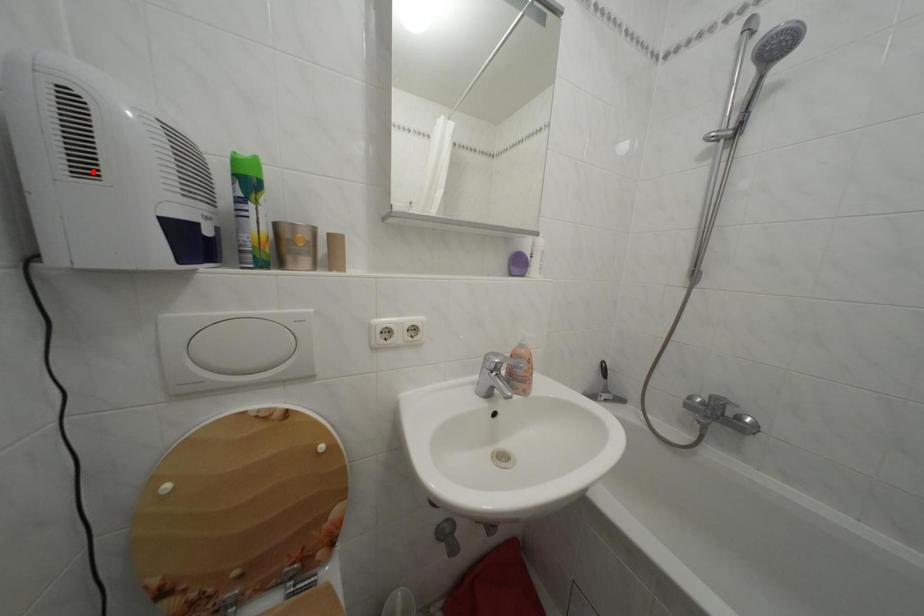
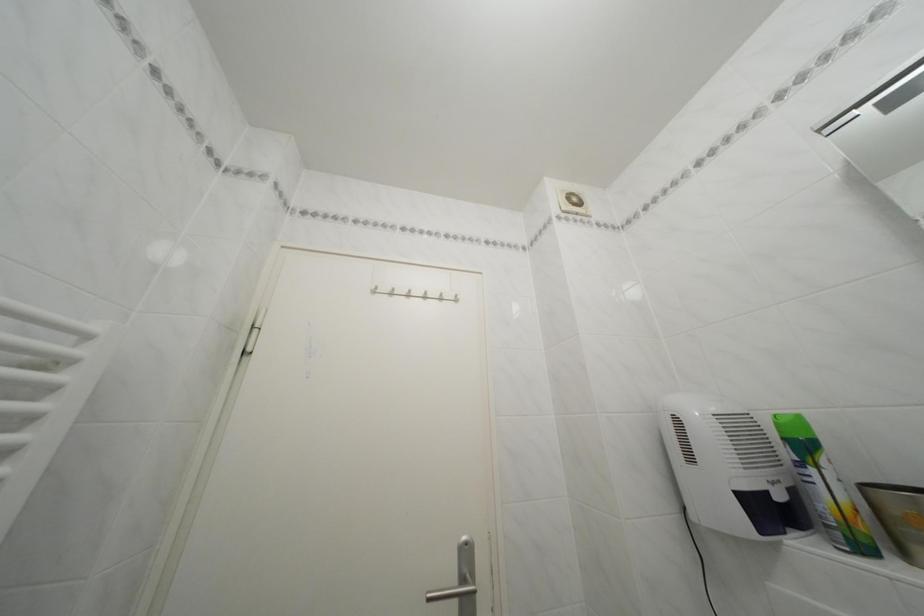
Find the pixel in the second image that matches the highlighted location in the first image.

(699, 464)